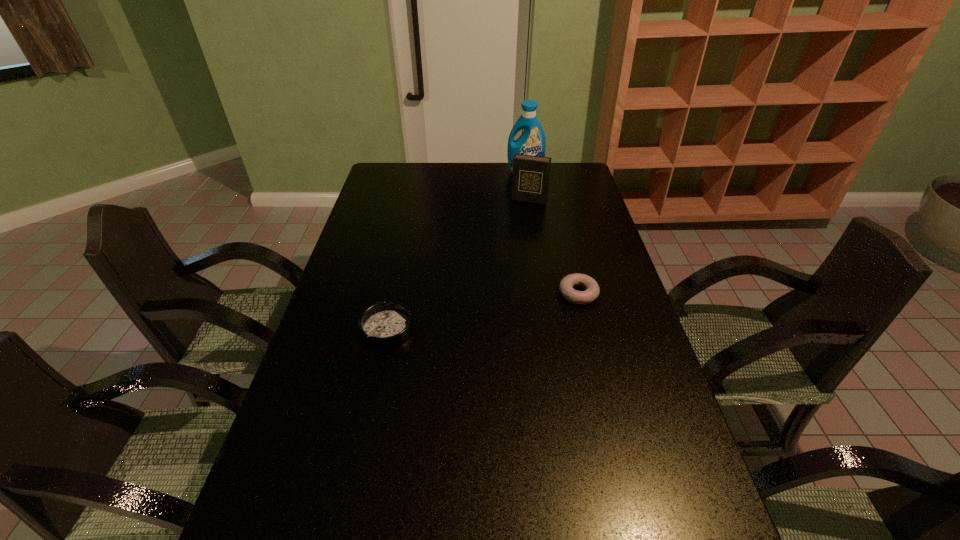
At what (x,y) coordinates should I click in order to perform the action: click on the leftmost object. Please return your answer as a coordinate pair (x, y). The width and height of the screenshot is (960, 540). Looking at the image, I should click on tap(382, 325).

Locate an element on the screen. The image size is (960, 540). the nearest object is located at coordinates (382, 325).

Identify the location of doughnut. The height and width of the screenshot is (540, 960). (592, 290).

The width and height of the screenshot is (960, 540). I want to click on diary, so click(x=530, y=179).

Identify the location of the third nearest object. This screenshot has width=960, height=540. (530, 179).

The width and height of the screenshot is (960, 540). What are the coordinates of `detergent` in the screenshot? It's located at (532, 141).

Find the location of a particular element. The image size is (960, 540). the farthest object is located at coordinates (532, 141).

You are a GUI agent. You are given a task and a screenshot of the screen. Output one action in this format:
    pyautogui.click(x=<x>, y=<y>)
    Task: Click on the vacant space located 0.250m on the front of the nearest object
    This screenshot has width=960, height=540.
    Given the screenshot: What is the action you would take?
    pyautogui.click(x=365, y=436)

Identify the location of free space located on the back of the doughnut. (559, 214).

I want to click on free region located on the front cover of the second farthest object, so click(507, 255).